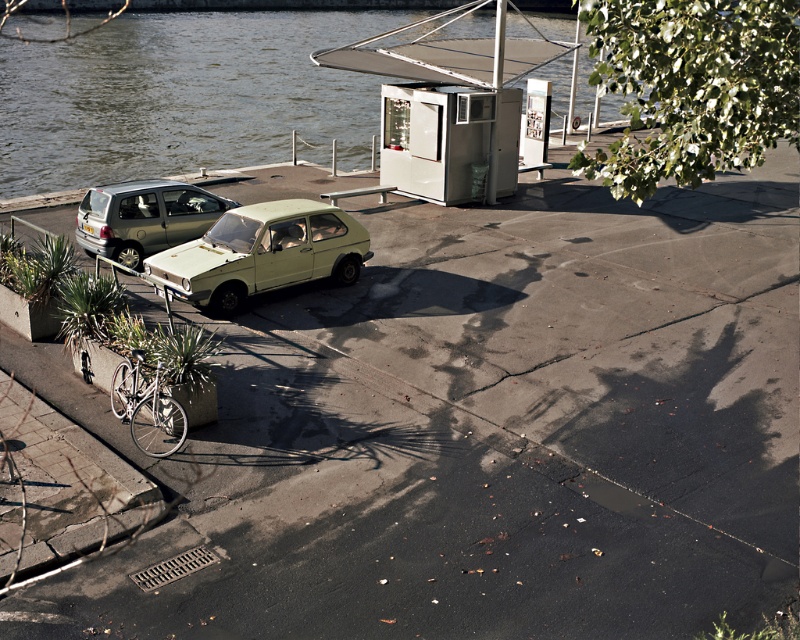
Question: Which of the following is the farthest from the observer?

Choices:
 (A) (194, 252)
 (B) (165, 228)

Answer: (B)

Question: Which point is closer to the camera taking this photo?

Choices:
 (A) (x=98, y=196)
 (B) (x=156, y=253)

Answer: (B)

Question: Among these points, which one is nearest to the camera?

Choices:
 (A) (126, 244)
 (B) (272, 250)

Answer: (B)

Question: Is light green matte car at center in front of matte green car at left?

Choices:
 (A) yes
 (B) no

Answer: (A)

Question: Considering the relative positions of light green matte car at center and matte green car at left in the image provided, where is light green matte car at center located with respect to matte green car at left?

Choices:
 (A) below
 (B) above

Answer: (A)

Question: Is light green matte car at center closer to the viewer compared to matte green car at left?

Choices:
 (A) no
 (B) yes

Answer: (B)